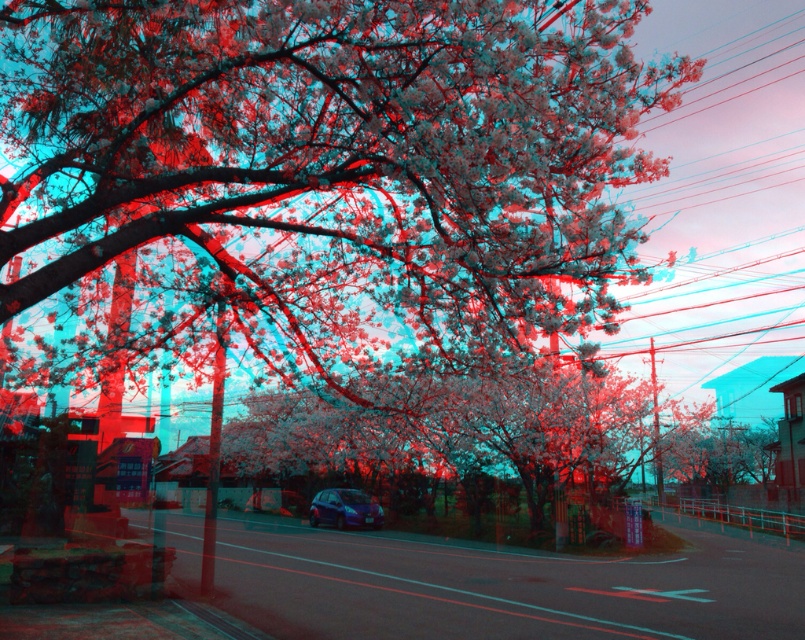
Question: Considering the relative positions of white matte flower at upper center and metallic blue hatchback at center in the image provided, where is white matte flower at upper center located with respect to metallic blue hatchback at center?

Choices:
 (A) above
 (B) below

Answer: (A)

Question: Does white matte flower at upper center appear on the left side of metallic blue hatchback at center?

Choices:
 (A) no
 (B) yes

Answer: (A)

Question: Among these points, which one is nearest to the camera?

Choices:
 (A) (345, 493)
 (B) (217, 140)

Answer: (B)

Question: Which of the following is the closest to the observer?

Choices:
 (A) white matte flower at upper center
 (B) metallic blue hatchback at center

Answer: (A)

Question: Which of the following is the farthest from the observer?

Choices:
 (A) white matte flower at upper center
 (B) metallic blue hatchback at center

Answer: (B)

Question: Can you confirm if white matte flower at upper center is positioned to the right of metallic blue hatchback at center?

Choices:
 (A) yes
 (B) no

Answer: (A)